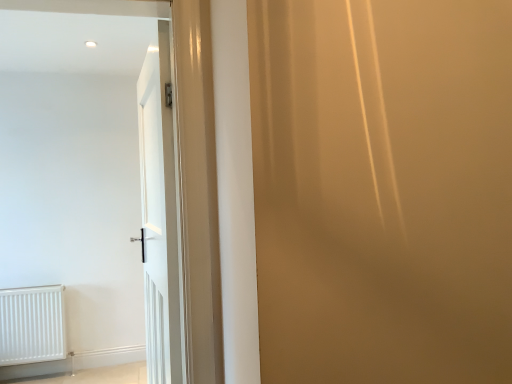
Question: From a real-world perspective, is white matte radiator at lower left positioned above or below white glossy door at center?

Choices:
 (A) above
 (B) below

Answer: (B)

Question: Considering the positions of point (59, 307) and point (166, 56), is point (59, 307) closer or farther from the camera than point (166, 56)?

Choices:
 (A) closer
 (B) farther

Answer: (B)

Question: Visually, is white matte radiator at lower left positioned to the left or to the right of white glossy door at center?

Choices:
 (A) right
 (B) left

Answer: (B)

Question: Considering their positions, is white glossy door at center located in front of or behind white matte radiator at lower left?

Choices:
 (A) front
 (B) behind

Answer: (A)

Question: Is point (159, 122) closer or farther from the camera than point (59, 291)?

Choices:
 (A) farther
 (B) closer

Answer: (B)

Question: Based on their sizes in the image, would you say white glossy door at center is bigger or smaller than white matte radiator at lower left?

Choices:
 (A) big
 (B) small

Answer: (A)

Question: From a real-world perspective, relative to white matte radiator at lower left, is white glossy door at center vertically above or below?

Choices:
 (A) above
 (B) below

Answer: (A)